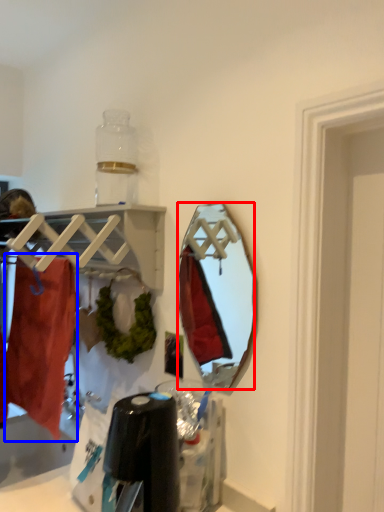
Question: Which object is closer to the camera taking this photo, mirror (highlighted by a red box) or clothing (highlighted by a blue box)?

Choices:
 (A) mirror
 (B) clothing

Answer: (A)